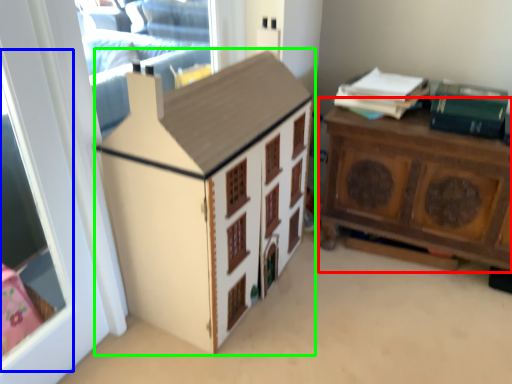
Question: Which is farther away from nightstand (highlighted by a red box)? window screen (highlighted by a blue box) or cabinetry (highlighted by a green box)?

Choices:
 (A) window screen
 (B) cabinetry

Answer: (A)